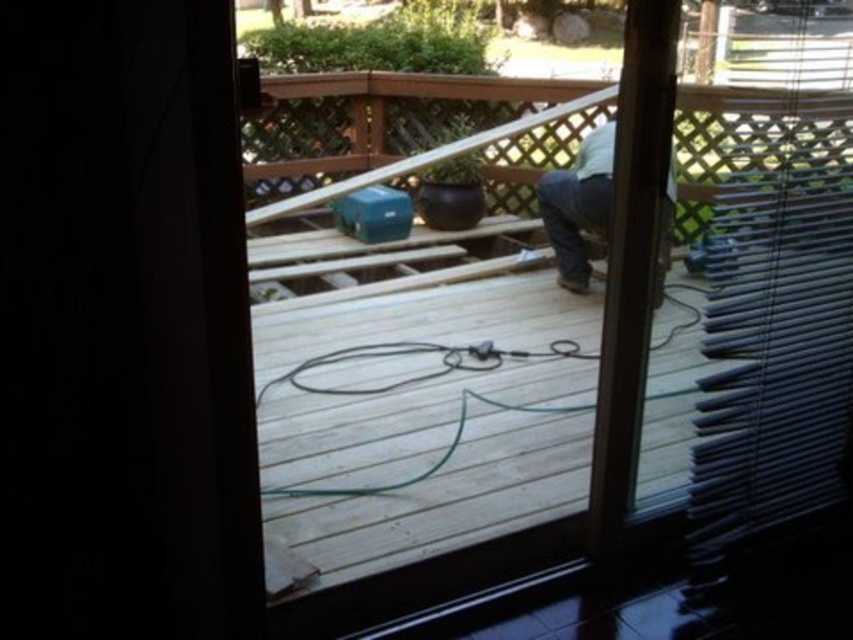
Question: Does transparent glass door at center have a lesser width compared to light brown wood pants at center?

Choices:
 (A) no
 (B) yes

Answer: (A)

Question: In this image, where is transparent glass door at center located relative to light brown wood pants at center?

Choices:
 (A) right
 (B) left

Answer: (B)

Question: Among these objects, which one is farthest from the camera?

Choices:
 (A) light brown wood pants at center
 (B) transparent glass door at center

Answer: (A)

Question: From the image, what is the correct spatial relationship of transparent glass door at center in relation to light brown wood pants at center?

Choices:
 (A) below
 (B) above

Answer: (A)

Question: Among these objects, which one is farthest from the camera?

Choices:
 (A) light brown wood pants at center
 (B) transparent glass door at center

Answer: (A)